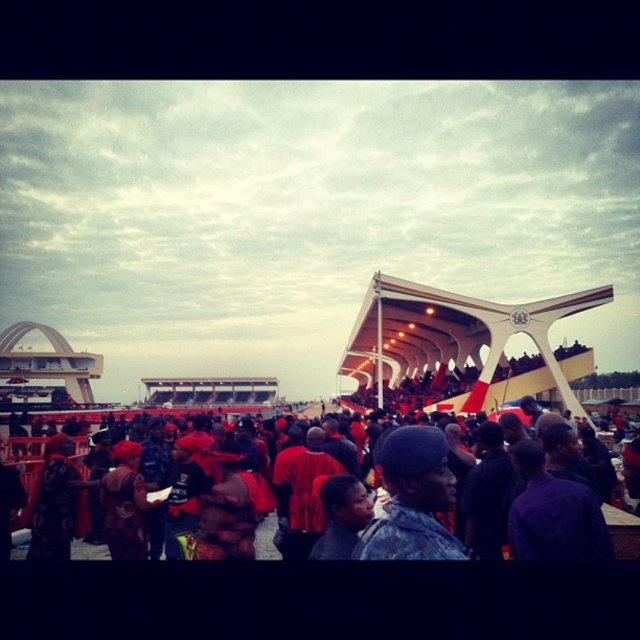
Question: Can you confirm if camouflage uniform at center is positioned to the left of red fabric clothing at lower center?

Choices:
 (A) no
 (B) yes

Answer: (A)

Question: Among these objects, which one is farthest from the camera?

Choices:
 (A) camouflage uniform at center
 (B) red fabric clothing at lower center

Answer: (B)

Question: Can you confirm if camouflage uniform at center is bigger than red fabric clothing at lower center?

Choices:
 (A) yes
 (B) no

Answer: (B)

Question: Is the position of camouflage uniform at center more distant than that of red fabric clothing at lower center?

Choices:
 (A) no
 (B) yes

Answer: (A)